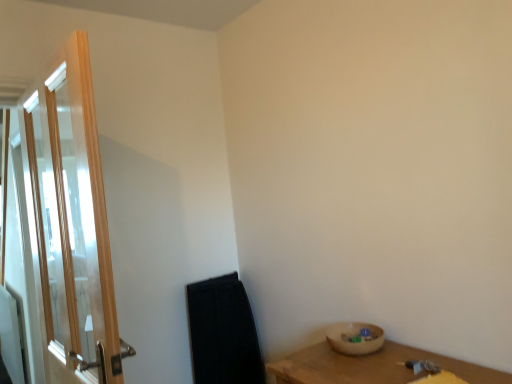
Question: Is point (377, 331) positioned closer to the camera than point (37, 140)?

Choices:
 (A) farther
 (B) closer

Answer: (B)

Question: Considering the relative positions of wooden bowl at lower right and clear glass door at left in the image provided, is wooden bowl at lower right to the left or to the right of clear glass door at left?

Choices:
 (A) right
 (B) left

Answer: (A)

Question: Looking at the image, does wooden bowl at lower right seem bigger or smaller compared to clear glass door at left?

Choices:
 (A) big
 (B) small

Answer: (B)

Question: From a real-world perspective, is clear glass door at left above or below wooden bowl at lower right?

Choices:
 (A) below
 (B) above

Answer: (B)

Question: Considering the positions of clear glass door at left and wooden bowl at lower right in the image, is clear glass door at left wider or thinner than wooden bowl at lower right?

Choices:
 (A) thin
 (B) wide

Answer: (A)

Question: From the image's perspective, relative to wooden bowl at lower right, is clear glass door at left above or below?

Choices:
 (A) below
 (B) above

Answer: (B)

Question: In the image, is clear glass door at left positioned in front of or behind wooden bowl at lower right?

Choices:
 (A) front
 (B) behind

Answer: (A)